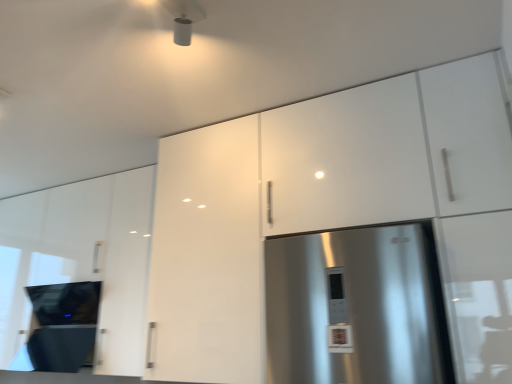
Find the location of a particular element. glossy white cabinet at upper left, acting as the 1th cabinetry starting from the left is located at coordinates (82, 258).

Where is `white glossy cabinet at upper right, positioned as the 1th cabinetry in right-to-left order`? white glossy cabinet at upper right, positioned as the 1th cabinetry in right-to-left order is located at coordinates (319, 201).

Find the location of a particular element. This screenshot has width=512, height=384. white glossy cabinet at center, which appears as the second cabinetry when viewed from the left is located at coordinates [x=207, y=257].

Between point (468, 86) and point (87, 333), which one is positioned behind?

The point (87, 333) is farther.

Which is more to the left, white glossy cabinet at upper right, positioned as the 1th cabinetry in right-to-left order, or black glass cooktop at lower left?

black glass cooktop at lower left.

From the image's perspective, between white glossy cabinet at upper right, which appears as the third cabinetry when viewed from the left, and black glass cooktop at lower left, which one is located above?

white glossy cabinet at upper right, which appears as the third cabinetry when viewed from the left, is shown above in the image.

Is white glossy cabinet at upper right, positioned as the 1th cabinetry in right-to-left order, in contact with black glass cooktop at lower left?

white glossy cabinet at upper right, positioned as the 1th cabinetry in right-to-left order, and black glass cooktop at lower left are clearly separated.

Does point (34, 338) come behind point (103, 241)?

No, it is in front of (103, 241).

Could you measure the distance between black glass cooktop at lower left and glossy white cabinet at upper left, positioned as the third cabinetry in right-to-left order?

The distance of black glass cooktop at lower left from glossy white cabinet at upper left, positioned as the third cabinetry in right-to-left order, is 26.11 centimeters.

From the image's perspective, is black glass cooktop at lower left on top of glossy white cabinet at upper left, positioned as the third cabinetry in right-to-left order?

No.

Considering the positions of objects black glass cooktop at lower left and glossy white cabinet at upper left, positioned as the third cabinetry in right-to-left order, in the image provided, who is more to the left, black glass cooktop at lower left or glossy white cabinet at upper left, positioned as the third cabinetry in right-to-left order,?

glossy white cabinet at upper left, positioned as the third cabinetry in right-to-left order.

Would you say glossy white cabinet at upper left, positioned as the third cabinetry in right-to-left order, is outside black glass cooktop at lower left?

glossy white cabinet at upper left, positioned as the third cabinetry in right-to-left order, lies outside black glass cooktop at lower left's area.

In the scene shown: From their relative heights in the image, would you say glossy white cabinet at upper left, acting as the 1th cabinetry starting from the left, is taller or shorter than black glass cooktop at lower left?

In the image, glossy white cabinet at upper left, acting as the 1th cabinetry starting from the left, appears to be taller than black glass cooktop at lower left.

Considering the points (7, 354) and (32, 336), which point is in front, point (7, 354) or point (32, 336)?

The point (32, 336) is closer.

From the image's perspective, is glossy white cabinet at upper left, positioned as the third cabinetry in right-to-left order, above or below black glass cooktop at lower left?

Clearly, from the image's perspective, glossy white cabinet at upper left, positioned as the third cabinetry in right-to-left order, is above black glass cooktop at lower left.

Would you say white glossy cabinet at center, which is the second cabinetry from right to left, is a long distance from white glossy cabinet at upper right, positioned as the 1th cabinetry in right-to-left order?

No, white glossy cabinet at center, which is the second cabinetry from right to left, is in close proximity to white glossy cabinet at upper right, positioned as the 1th cabinetry in right-to-left order.

From a real-world perspective, does white glossy cabinet at center, which is the second cabinetry from right to left, sit lower than white glossy cabinet at upper right, positioned as the 1th cabinetry in right-to-left order?

Yes, from a real-world perspective, white glossy cabinet at center, which is the second cabinetry from right to left, is below white glossy cabinet at upper right, positioned as the 1th cabinetry in right-to-left order.

Could you tell me if white glossy cabinet at center, which appears as the second cabinetry when viewed from the left, is facing white glossy cabinet at upper right, which appears as the third cabinetry when viewed from the left?

No.

Does point (228, 206) come in front of point (467, 108)?

That is False.

Who is bigger, white glossy cabinet at center, which is the second cabinetry from right to left, or glossy white cabinet at upper left, acting as the 1th cabinetry starting from the left?

glossy white cabinet at upper left, acting as the 1th cabinetry starting from the left.

Is white glossy cabinet at center, which appears as the second cabinetry when viewed from the left, aimed at glossy white cabinet at upper left, acting as the 1th cabinetry starting from the left?

No, white glossy cabinet at center, which appears as the second cabinetry when viewed from the left, is not oriented towards glossy white cabinet at upper left, acting as the 1th cabinetry starting from the left.

Does white glossy cabinet at center, which appears as the second cabinetry when viewed from the left, have a greater height compared to glossy white cabinet at upper left, acting as the 1th cabinetry starting from the left?

Yes.

Image resolution: width=512 pixels, height=384 pixels. In order to click on cabinetry that appears below the glossy white cabinet at upper left, acting as the 1th cabinetry starting from the left (from a real-world perspective) in this screenshot , I will do pos(207,257).

Is point (344, 149) positioned behind point (156, 270)?

That is False.

From a real-world perspective, is white glossy cabinet at upper right, which appears as the third cabinetry when viewed from the left, positioned under white glossy cabinet at center, which appears as the second cabinetry when viewed from the left, based on gravity?

No, from a real-world perspective, white glossy cabinet at upper right, which appears as the third cabinetry when viewed from the left, is not beneath white glossy cabinet at center, which appears as the second cabinetry when viewed from the left.

Do you think white glossy cabinet at upper right, positioned as the 1th cabinetry in right-to-left order, is within white glossy cabinet at center, which appears as the second cabinetry when viewed from the left, or outside of it?

white glossy cabinet at upper right, positioned as the 1th cabinetry in right-to-left order, is outside white glossy cabinet at center, which appears as the second cabinetry when viewed from the left.

Could you tell me if white glossy cabinet at upper right, positioned as the 1th cabinetry in right-to-left order, is turned towards white glossy cabinet at center, which appears as the second cabinetry when viewed from the left?

No, white glossy cabinet at upper right, positioned as the 1th cabinetry in right-to-left order, is not facing towards white glossy cabinet at center, which appears as the second cabinetry when viewed from the left.

Considering the relative positions of black glass cooktop at lower left and white glossy cabinet at upper right, positioned as the 1th cabinetry in right-to-left order, in the image provided, is black glass cooktop at lower left to the left of white glossy cabinet at upper right, positioned as the 1th cabinetry in right-to-left order, from the viewer's perspective?

Yes, black glass cooktop at lower left is to the left of white glossy cabinet at upper right, positioned as the 1th cabinetry in right-to-left order.

Looking at this image, can you see black glass cooktop at lower left touching white glossy cabinet at upper right, positioned as the 1th cabinetry in right-to-left order?

black glass cooktop at lower left and white glossy cabinet at upper right, positioned as the 1th cabinetry in right-to-left order, are clearly separated.

From a real-world perspective, relative to white glossy cabinet at upper right, which appears as the third cabinetry when viewed from the left, is black glass cooktop at lower left vertically above or below?

black glass cooktop at lower left is below white glossy cabinet at upper right, which appears as the third cabinetry when viewed from the left.

Where is `cabinetry that is the 3rd object located in front of the black glass cooktop at lower left`? cabinetry that is the 3rd object located in front of the black glass cooktop at lower left is located at coordinates [319, 201].

This screenshot has width=512, height=384. What are the coordinates of `appliance on the right of the glossy white cabinet at upper left, acting as the 1th cabinetry starting from the left` in the screenshot? It's located at (63, 325).

Based on their spatial positions, is white glossy cabinet at upper right, positioned as the 1th cabinetry in right-to-left order, or white glossy cabinet at center, which is the second cabinetry from right to left, closer to glossy white cabinet at upper left, acting as the 1th cabinetry starting from the left?

white glossy cabinet at center, which is the second cabinetry from right to left.

Considering their positions, is glossy white cabinet at upper left, positioned as the third cabinetry in right-to-left order, positioned further to black glass cooktop at lower left than white glossy cabinet at center, which is the second cabinetry from right to left?

white glossy cabinet at center, which is the second cabinetry from right to left, is positioned further to the anchor black glass cooktop at lower left.

Estimate the real-world distances between objects in this image. Which object is closer to glossy white cabinet at upper left, positioned as the third cabinetry in right-to-left order, white glossy cabinet at center, which appears as the second cabinetry when viewed from the left, or black glass cooktop at lower left?

black glass cooktop at lower left lies closer to glossy white cabinet at upper left, positioned as the third cabinetry in right-to-left order, than the other object.

From the image, which object appears to be farther from white glossy cabinet at center, which appears as the second cabinetry when viewed from the left, white glossy cabinet at upper right, positioned as the 1th cabinetry in right-to-left order, or black glass cooktop at lower left?

black glass cooktop at lower left.

Which object lies nearer to the anchor point glossy white cabinet at upper left, acting as the 1th cabinetry starting from the left, black glass cooktop at lower left or white glossy cabinet at upper right, positioned as the 1th cabinetry in right-to-left order?

black glass cooktop at lower left is positioned closer to the anchor glossy white cabinet at upper left, acting as the 1th cabinetry starting from the left.

When comparing their distances from black glass cooktop at lower left, does white glossy cabinet at upper right, positioned as the 1th cabinetry in right-to-left order, or white glossy cabinet at center, which appears as the second cabinetry when viewed from the left, seem closer?

The object closer to black glass cooktop at lower left is white glossy cabinet at center, which appears as the second cabinetry when viewed from the left.

Estimate the real-world distances between objects in this image. Which object is closer to white glossy cabinet at center, which appears as the second cabinetry when viewed from the left, glossy white cabinet at upper left, acting as the 1th cabinetry starting from the left, or black glass cooktop at lower left?

glossy white cabinet at upper left, acting as the 1th cabinetry starting from the left, is positioned closer to the anchor white glossy cabinet at center, which appears as the second cabinetry when viewed from the left.

When comparing their distances from white glossy cabinet at upper right, which appears as the third cabinetry when viewed from the left, does white glossy cabinet at center, which is the second cabinetry from right to left, or black glass cooktop at lower left seem further?

Based on the image, black glass cooktop at lower left appears to be further to white glossy cabinet at upper right, which appears as the third cabinetry when viewed from the left.

Where is `appliance situated between glossy white cabinet at upper left, acting as the 1th cabinetry starting from the left, and white glossy cabinet at upper right, positioned as the 1th cabinetry in right-to-left order, from left to right`? The height and width of the screenshot is (384, 512). appliance situated between glossy white cabinet at upper left, acting as the 1th cabinetry starting from the left, and white glossy cabinet at upper right, positioned as the 1th cabinetry in right-to-left order, from left to right is located at coordinates (63, 325).

Identify the location of appliance between glossy white cabinet at upper left, positioned as the third cabinetry in right-to-left order, and white glossy cabinet at center, which appears as the second cabinetry when viewed from the left, from left to right. The width and height of the screenshot is (512, 384). (63, 325).

Locate an element on the screen. cabinetry between black glass cooktop at lower left and white glossy cabinet at upper right, which appears as the third cabinetry when viewed from the left is located at coordinates (207, 257).

At what (x,y) coordinates should I click in order to perform the action: click on cabinetry between glossy white cabinet at upper left, acting as the 1th cabinetry starting from the left, and white glossy cabinet at upper right, which appears as the third cabinetry when viewed from the left, from left to right. Please return your answer as a coordinate pair (x, y). Image resolution: width=512 pixels, height=384 pixels. Looking at the image, I should click on (207, 257).